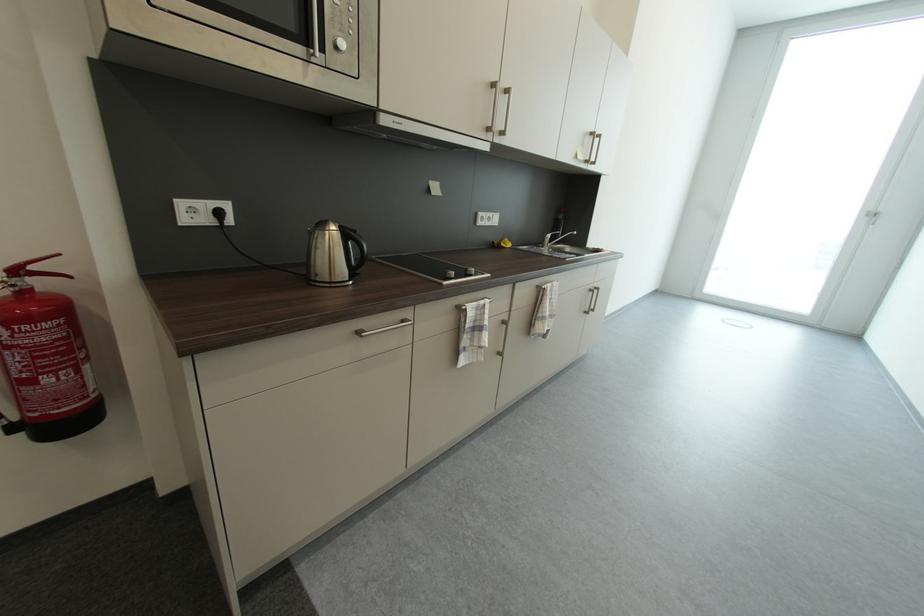
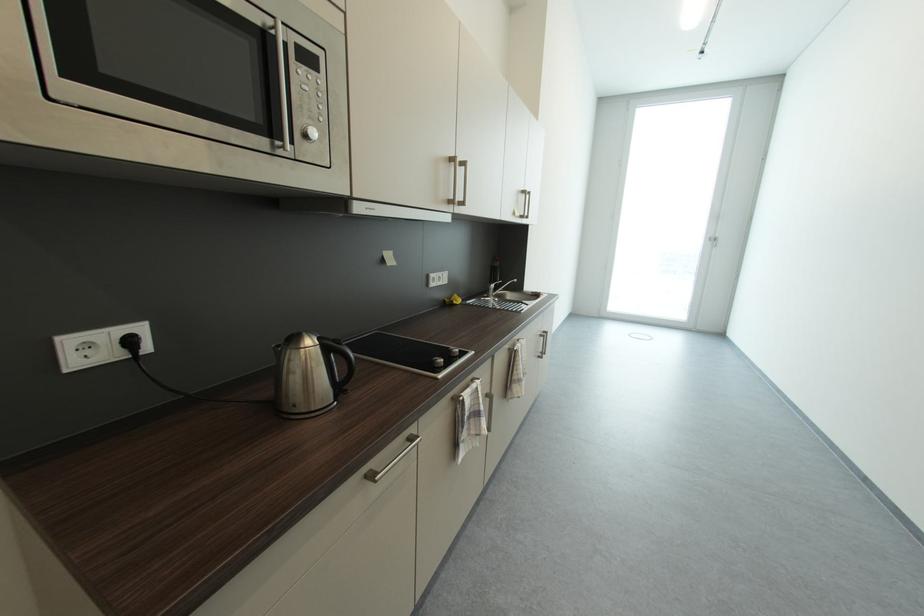
Where in the second image is the point corresponding to point (501, 244) from the first image?

(453, 302)